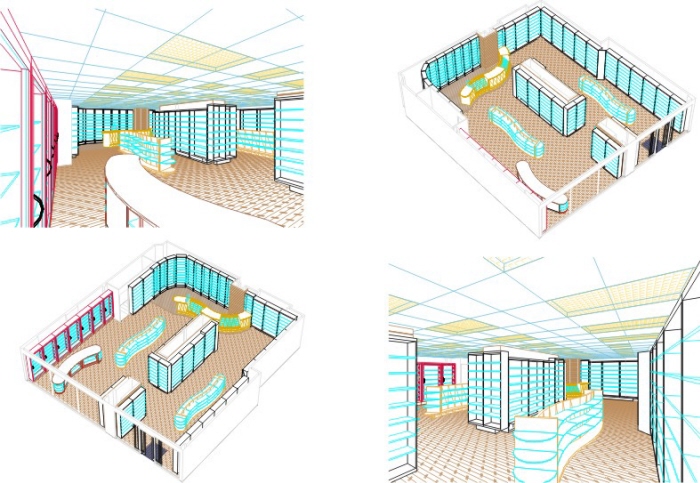
At what (x,y) coordinates should I click in order to perform the action: click on light. Please return your answer as a coordinate pair (x, y). This screenshot has height=483, width=700. Looking at the image, I should click on (197, 62).